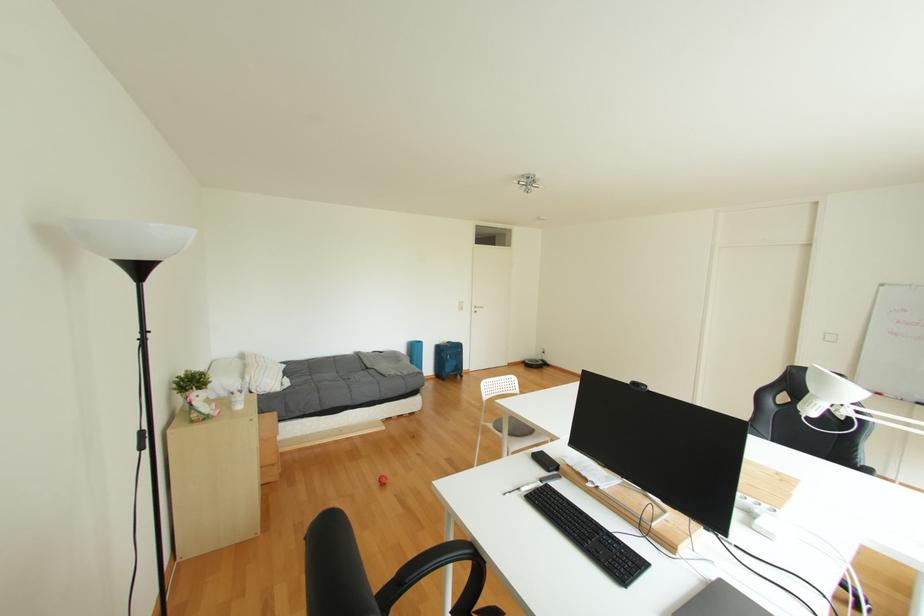
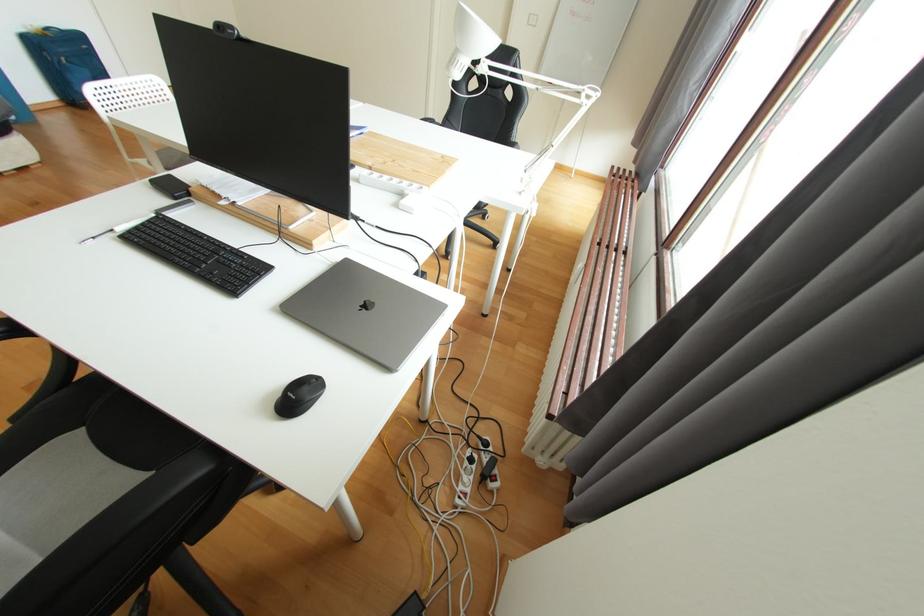
Based on the continuous images, in which direction is the camera rotating?

The rotation direction of the camera is right-down.